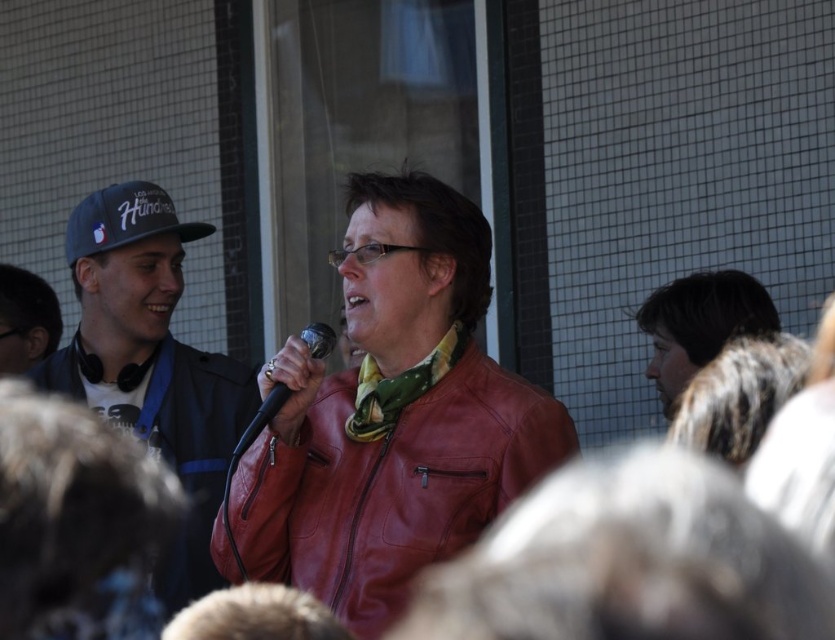
You are a photographer trying to capture a clear shot of both the matte black cap at left and the blue fabric baseball cap at left. Since you want both caps to be in focus, which one should you adjust your camera focus on first?

You should focus on the matte black cap at left first because it is closer to the viewer than the blue fabric baseball cap at left. This way, adjusting focus from near to far can help ensure both are in focus.

You are a photographer at a public event. You see the blue fabric baseball cap at left and a camera. How far apart are they?

The blue fabric baseball cap at left and the camera are 25.40 meters apart from each other.

You are an event organizer checking the seating arrangement. You notice two caps at the left side of the stage. Which cap is closer to the center of the stage, the matte black cap at left or the blue fabric baseball cap at left?

The matte black cap at left is positioned on the right side of the blue fabric baseball cap at left, so the matte black cap at left is closer to the center of the stage.